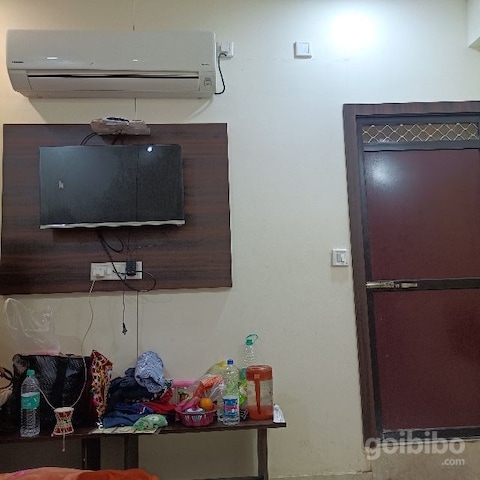
At what (x,y) coordinates should I click in order to perform the action: click on table legs. Please return your answer as a coordinate pair (x, y). This screenshot has height=480, width=480. Looking at the image, I should click on (133, 446), (92, 452), (261, 444).